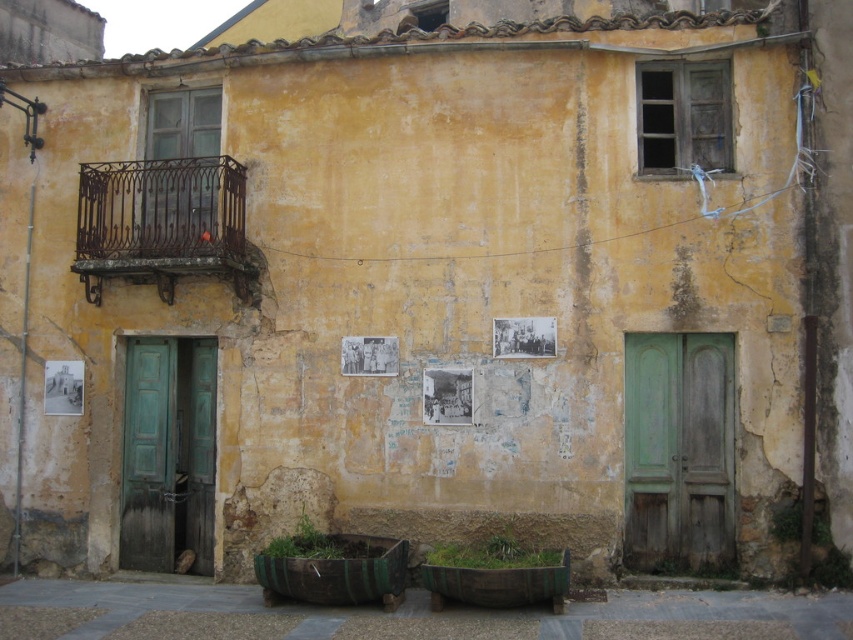
You are a delivery person trying to enter the building. You see two doors, the green wood door at right and the green wooden door at lower left. Which door is taller?

The green wooden door at lower left is taller than the green wood door at right.

You are standing in front of the aged building and want to enter through the green wood door at right. Based on its coordinates, is it located in the lower half of the building?

The green wood door at right is positioned at coordinates point (677, 451). Since the y coordinate 0.796 is greater than 0.5, it is located in the lower half of the building.